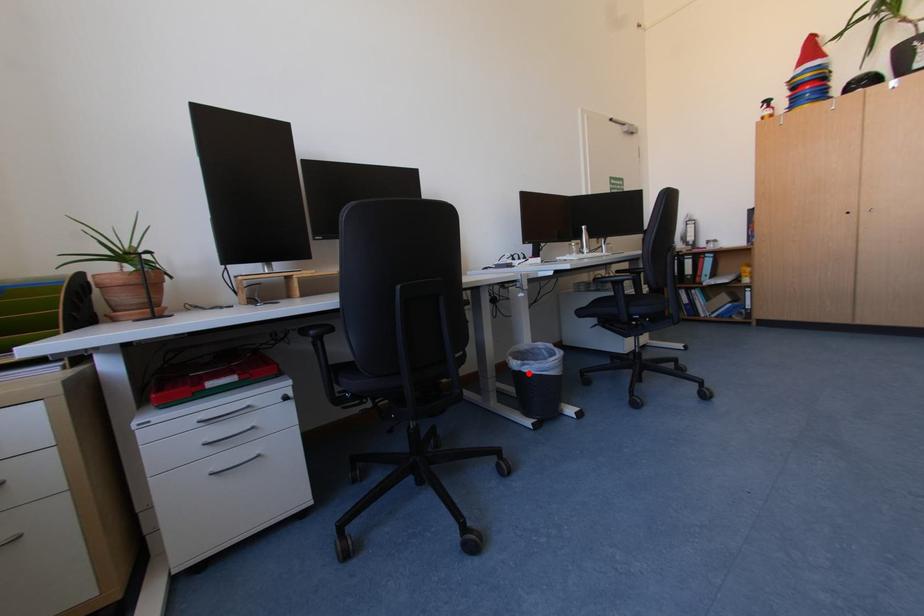
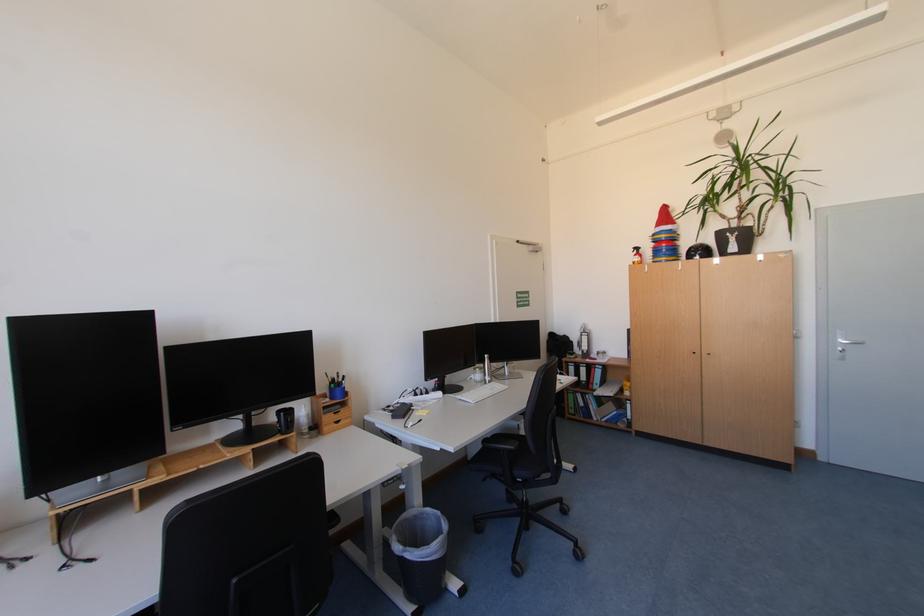
Where in the second image is the point corresponding to the highlighted location from the first image?

(409, 557)